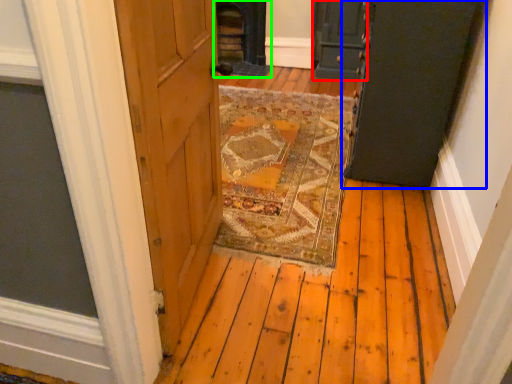
Question: Based on their relative distances, which object is farther from door (highlighted by a red box)? Choose from door (highlighted by a blue box) and fireplace (highlighted by a green box).

Choices:
 (A) door
 (B) fireplace

Answer: (A)